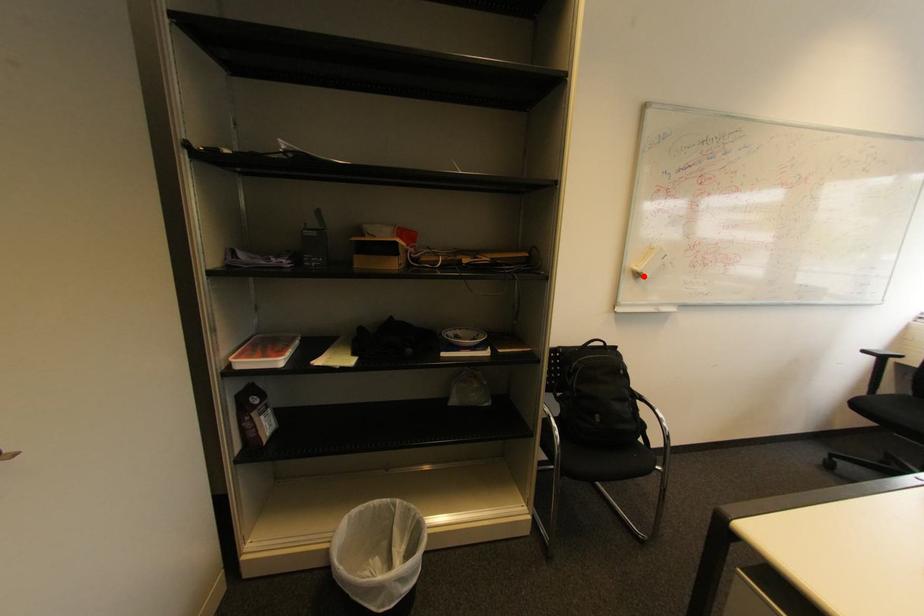
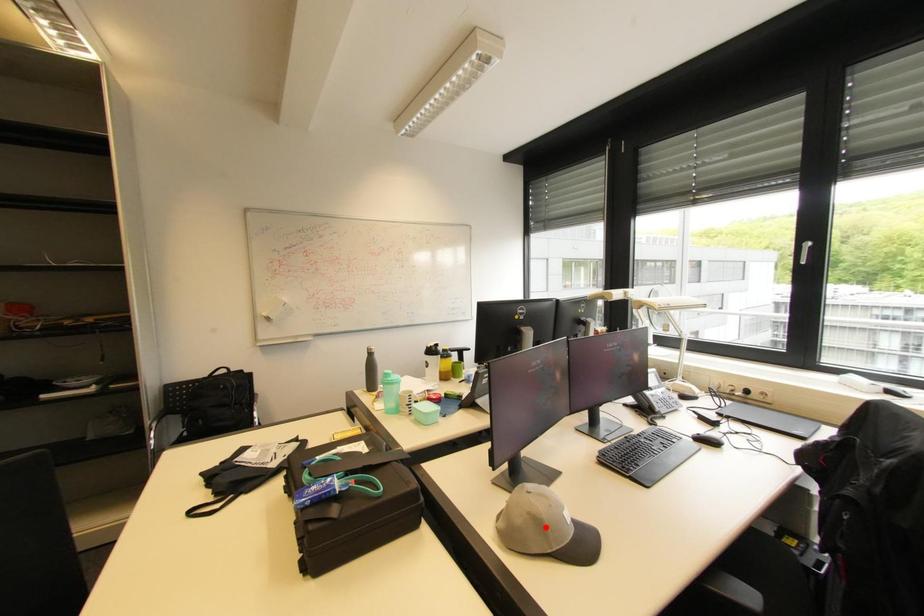
I am providing you with two images of the same scene from different viewpoints. A red point is marked on the first image and another point is marked on the second image. Is the red point in image1 aligned with the point shown in image2?

No